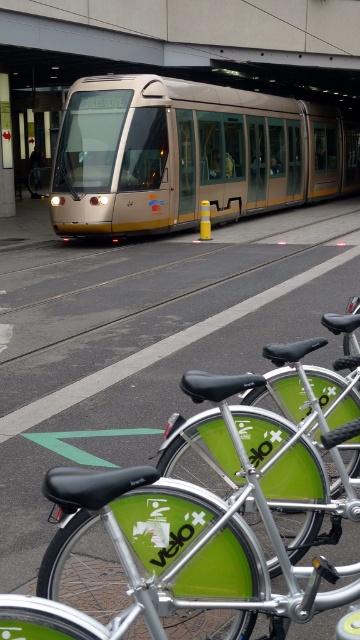
Question: Which object is the closest to the gold metallic train at center?

Choices:
 (A) green matte bicycle at center
 (B) green matte bicycle at lower center
 (C) green metallic bicycle at lower center

Answer: (A)

Question: Among these points, which one is nearest to the camera?

Choices:
 (A) [x=117, y=371]
 (B) [x=141, y=211]
 (C) [x=335, y=513]
 (D) [x=109, y=509]

Answer: (D)

Question: Is green metallic bicycle at lower center to the left of green matte bicycle at lower center from the viewer's perspective?

Choices:
 (A) no
 (B) yes

Answer: (B)

Question: Is green metallic bicycle at lower center above gold metallic train at center?

Choices:
 (A) yes
 (B) no

Answer: (B)

Question: Which of the following is the farthest from the observer?

Choices:
 (A) gold metallic train at center
 (B) green matte bicycle at lower center
 (C) green matte bicycle at center
 (D) green metallic bicycle at lower center

Answer: (A)

Question: Can you confirm if green metallic bicycle at lower center is positioned below green matte bicycle at center?

Choices:
 (A) no
 (B) yes

Answer: (B)